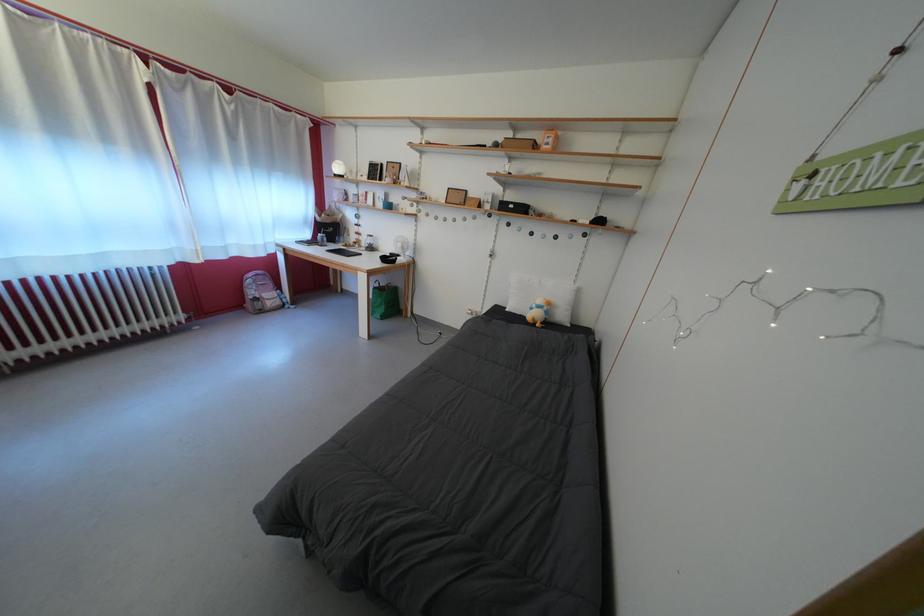
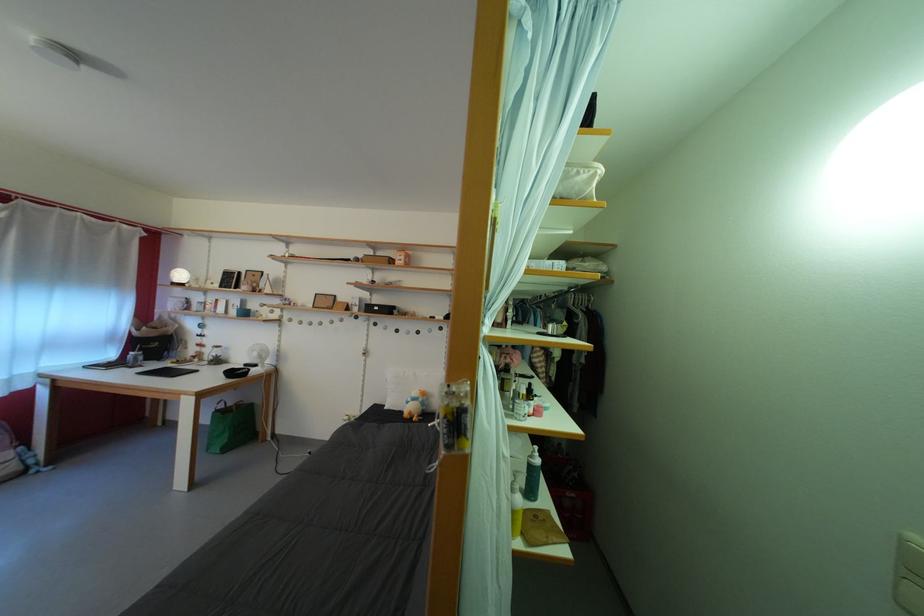
The point at [407,251] is marked in the first image. Where is the corresponding point in the second image?

(263, 360)